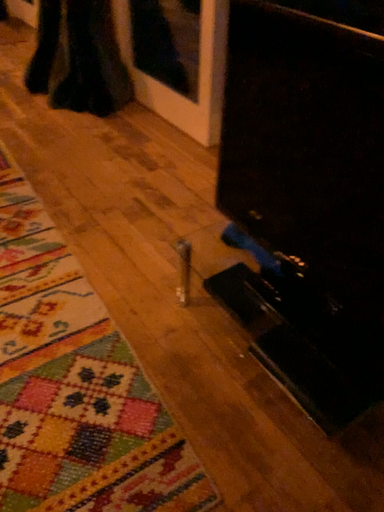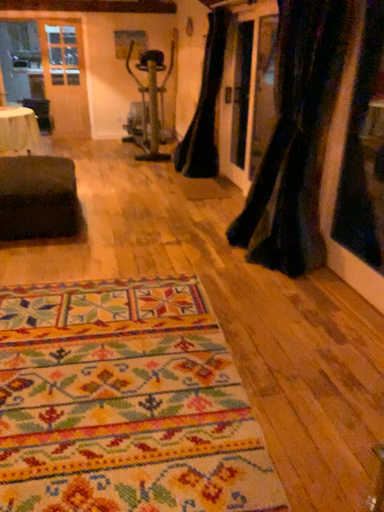
Question: Which way did the camera rotate in the video?

Choices:
 (A) rotated downward
 (B) rotated upward

Answer: (B)